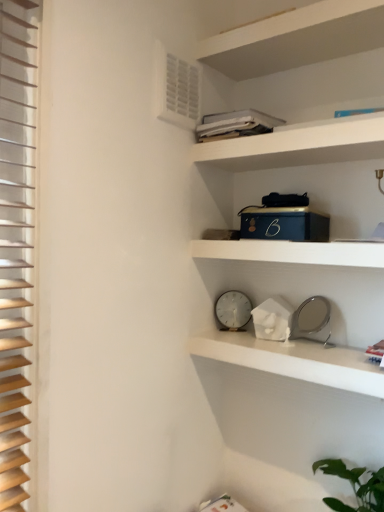
Question: Is white matte clock at center, which is the second shelf from bottom to top, not close to white plastic clock at center?

Choices:
 (A) yes
 (B) no

Answer: (B)

Question: Is white matte clock at center, positioned as the first shelf in top-to-bottom order, aimed at white plastic clock at center?

Choices:
 (A) yes
 (B) no

Answer: (B)

Question: Is white matte clock at center, positioned as the first shelf in top-to-bottom order, in contact with white plastic clock at center?

Choices:
 (A) no
 (B) yes

Answer: (A)

Question: From the image's perspective, is white matte clock at center, positioned as the first shelf in top-to-bottom order, located beneath white plastic clock at center?

Choices:
 (A) yes
 (B) no

Answer: (B)

Question: Considering the relative positions of white matte clock at center, which is the second shelf from bottom to top, and white plastic clock at center in the image provided, is white matte clock at center, which is the second shelf from bottom to top, to the left of white plastic clock at center from the viewer's perspective?

Choices:
 (A) yes
 (B) no

Answer: (B)

Question: From the image's perspective, relative to white matte clock at center, which is the second shelf from bottom to top, is white plastic air conditioning unit at upper left above or below?

Choices:
 (A) below
 (B) above

Answer: (B)

Question: Is white plastic air conditioning unit at upper left wider or thinner than white matte clock at center, positioned as the first shelf in top-to-bottom order?

Choices:
 (A) wide
 (B) thin

Answer: (B)

Question: Looking at the image, does white plastic air conditioning unit at upper left seem bigger or smaller compared to white matte clock at center, which is the second shelf from bottom to top?

Choices:
 (A) big
 (B) small

Answer: (B)

Question: From a real-world perspective, is white plastic air conditioning unit at upper left physically located above or below white matte clock at center, positioned as the first shelf in top-to-bottom order?

Choices:
 (A) above
 (B) below

Answer: (A)

Question: Is wooden blinds at left to the left or to the right of white marble clock at center, the first shelf when ordered from bottom to top, in the image?

Choices:
 (A) left
 (B) right

Answer: (A)

Question: Considering the positions of wooden blinds at left and white marble clock at center, the second shelf in the top-to-bottom sequence, in the image, is wooden blinds at left taller or shorter than white marble clock at center, the second shelf in the top-to-bottom sequence,?

Choices:
 (A) tall
 (B) short

Answer: (A)

Question: Looking at the image, does wooden blinds at left seem bigger or smaller compared to white marble clock at center, the first shelf when ordered from bottom to top?

Choices:
 (A) small
 (B) big

Answer: (A)

Question: In the image, is wooden blinds at left positioned in front of or behind white marble clock at center, the second shelf in the top-to-bottom sequence?

Choices:
 (A) behind
 (B) front

Answer: (B)

Question: Does point (253, 137) appear closer or farther from the camera than point (246, 300)?

Choices:
 (A) closer
 (B) farther

Answer: (A)

Question: Looking at their shapes, would you say white matte cabinet at upper center is wider or thinner than white plastic clock at center?

Choices:
 (A) wide
 (B) thin

Answer: (A)